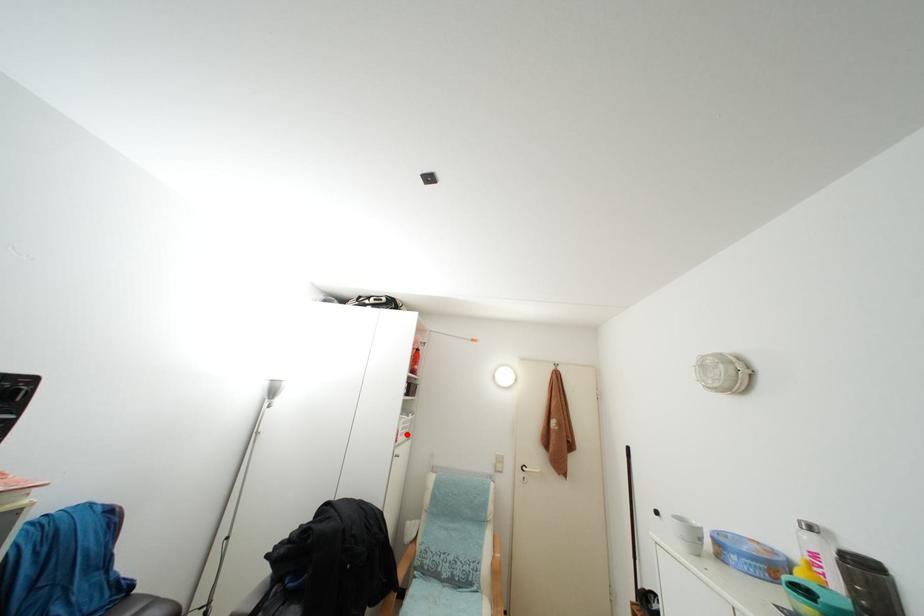
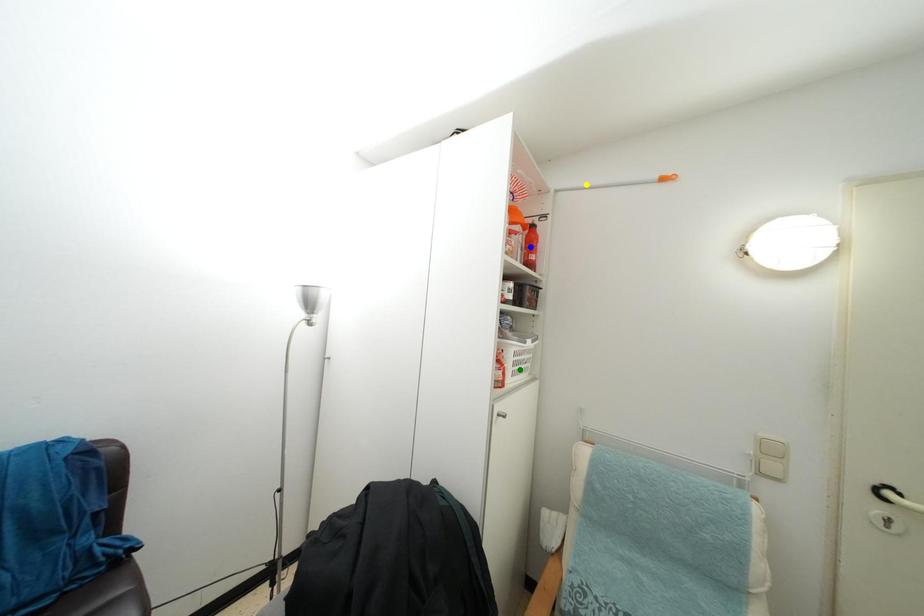
Question: I am providing you with two images of the same scene from different viewpoints. A red point is marked on the first image. You are given multiple points on the second image. Can you choose the point in image 2 that corresponds to the point in image 1?

Choices:
 (A) green point
 (B) yellow point
 (C) blue point

Answer: (A)